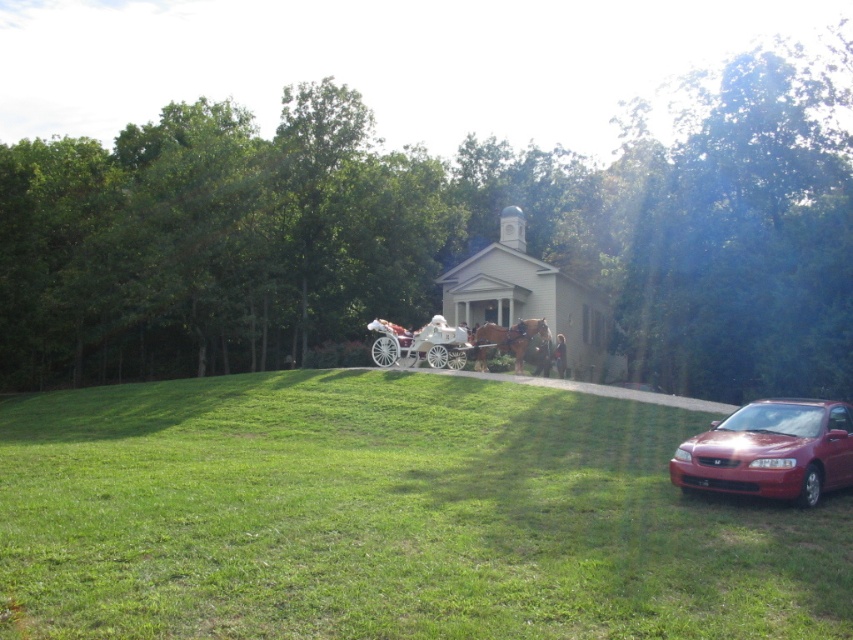
Question: Estimate the real-world distances between objects in this image. Which object is closer to the white glossy wagon at center?

Choices:
 (A) brown glossy horse at center
 (B) green grassy at lower left

Answer: (A)

Question: Can you confirm if shiny red sedan at lower right is wider than white glossy wagon at center?

Choices:
 (A) no
 (B) yes

Answer: (A)

Question: Which of these objects is positioned closest to the green grassy at lower left?

Choices:
 (A) white glossy wagon at center
 (B) brown glossy horse at center
 (C) shiny red sedan at lower right

Answer: (C)

Question: Which object is farther from the camera taking this photo?

Choices:
 (A) white glossy wagon at center
 (B) shiny red sedan at lower right
 (C) brown glossy horse at center

Answer: (C)

Question: Does shiny red sedan at lower right lie behind brown glossy horse at center?

Choices:
 (A) yes
 (B) no

Answer: (B)

Question: Considering the relative positions of shiny red sedan at lower right and brown glossy horse at center in the image provided, where is shiny red sedan at lower right located with respect to brown glossy horse at center?

Choices:
 (A) below
 (B) above

Answer: (A)